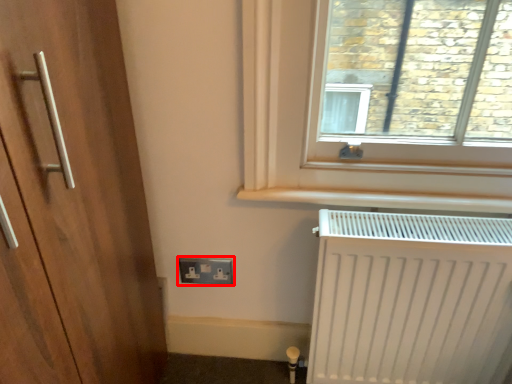
Question: From the image's perspective, where is electric outlet (annotated by the red box) located in relation to radiator in the image?

Choices:
 (A) below
 (B) above

Answer: (B)